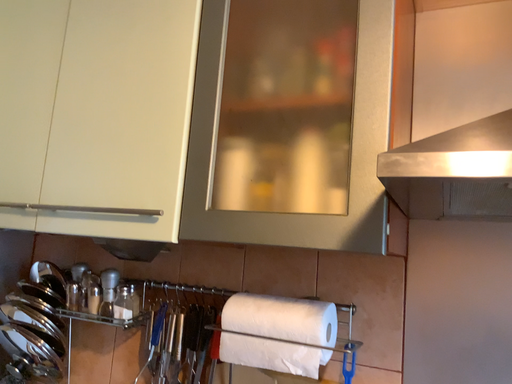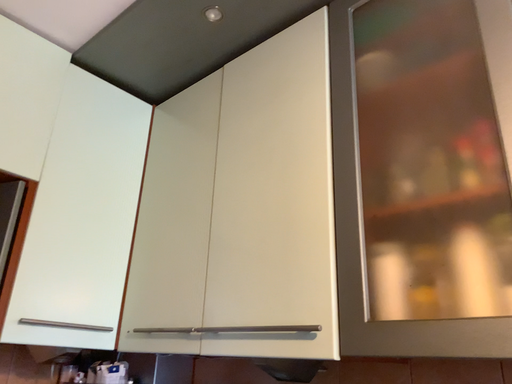
Question: How did the camera likely rotate when shooting the video?

Choices:
 (A) rotated right
 (B) rotated left

Answer: (B)